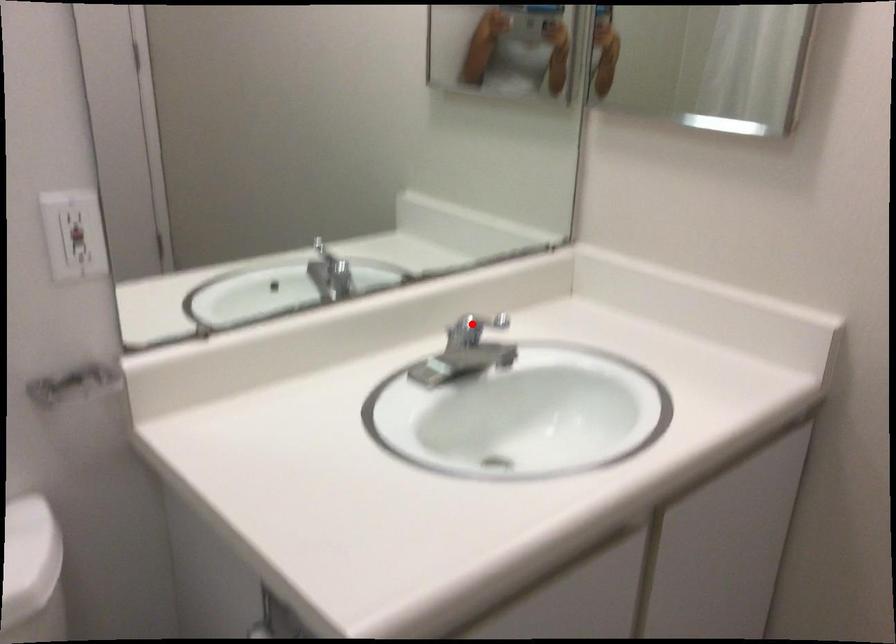
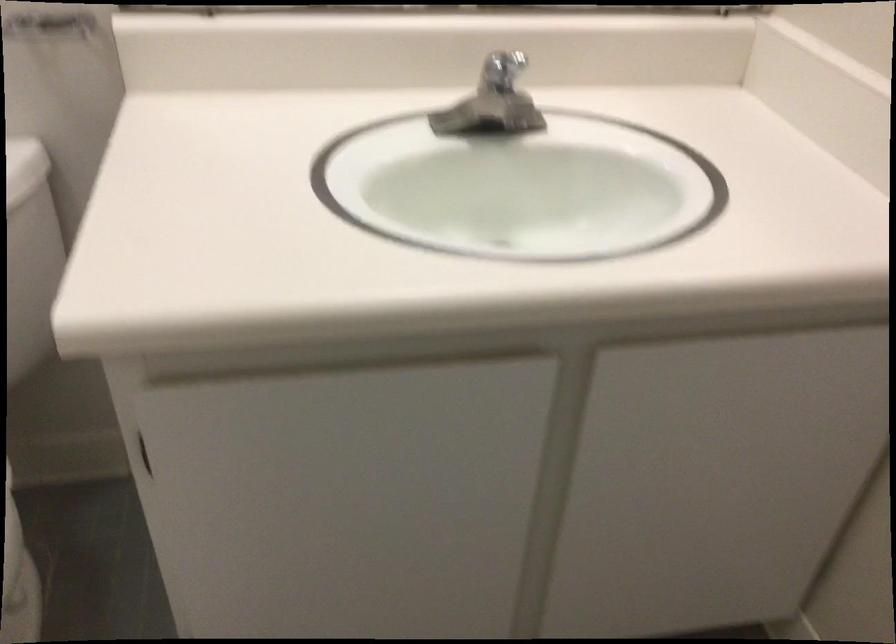
Find the pixel in the second image that matches the highlighted location in the first image.

(503, 70)